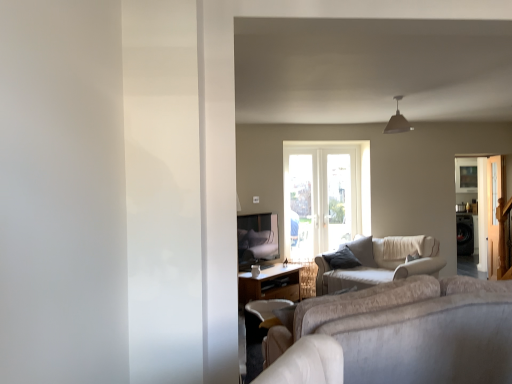
Question: Is beige fabric couch at center facing away from clear glass screen door at right, the first screen door when ordered from front to back?

Choices:
 (A) yes
 (B) no

Answer: (A)

Question: Does beige fabric couch at center have a greater height compared to clear glass screen door at right, the second screen door from the back?

Choices:
 (A) yes
 (B) no

Answer: (B)

Question: Is beige fabric couch at center with clear glass screen door at right, the first screen door when ordered from front to back?

Choices:
 (A) yes
 (B) no

Answer: (B)

Question: Does beige fabric couch at center lie in front of clear glass screen door at right, the second screen door from the back?

Choices:
 (A) yes
 (B) no

Answer: (A)

Question: Is beige fabric couch at center positioned beyond the bounds of clear glass screen door at right, the second screen door from the back?

Choices:
 (A) no
 (B) yes

Answer: (B)

Question: Visually, is clear glass screen door at right, the second screen door from the back, positioned to the left or to the right of metallic silver screen door at right, which appears as the 1th screen door when viewed from the back?

Choices:
 (A) right
 (B) left

Answer: (A)

Question: Choose the correct answer: Is clear glass screen door at right, the first screen door when ordered from front to back, inside metallic silver screen door at right, which appears as the 1th screen door when viewed from the back, or outside it?

Choices:
 (A) outside
 (B) inside

Answer: (A)

Question: Considering the positions of clear glass screen door at right, the second screen door from the back, and metallic silver screen door at right, which is the 2th screen door in front-to-back order, in the image, is clear glass screen door at right, the second screen door from the back, wider or thinner than metallic silver screen door at right, which is the 2th screen door in front-to-back order,?

Choices:
 (A) thin
 (B) wide

Answer: (B)

Question: Considering the positions of clear glass screen door at right, the second screen door from the back, and metallic silver screen door at right, which is the 2th screen door in front-to-back order, in the image, is clear glass screen door at right, the second screen door from the back, taller or shorter than metallic silver screen door at right, which is the 2th screen door in front-to-back order,?

Choices:
 (A) tall
 (B) short

Answer: (A)

Question: Would you say clear glass screen door at right, the first screen door when ordered from front to back, is inside or outside wooden table at center?

Choices:
 (A) outside
 (B) inside

Answer: (A)

Question: From a real-world perspective, is clear glass screen door at right, the first screen door when ordered from front to back, positioned above or below wooden table at center?

Choices:
 (A) above
 (B) below

Answer: (A)

Question: Considering the positions of clear glass screen door at right, the first screen door when ordered from front to back, and wooden table at center in the image, is clear glass screen door at right, the first screen door when ordered from front to back, taller or shorter than wooden table at center?

Choices:
 (A) tall
 (B) short

Answer: (A)

Question: Considering the positions of point (497, 231) and point (268, 279), is point (497, 231) closer or farther from the camera than point (268, 279)?

Choices:
 (A) closer
 (B) farther

Answer: (B)

Question: In terms of height, does metallic gray pendant light at upper center look taller or shorter compared to wooden table at center?

Choices:
 (A) short
 (B) tall

Answer: (A)

Question: From the image's perspective, is metallic gray pendant light at upper center above or below wooden table at center?

Choices:
 (A) below
 (B) above

Answer: (B)